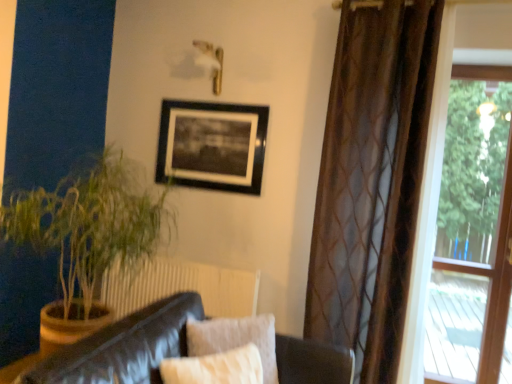
Question: Would you say leather couch at lower left is a long distance from transparent glass window at right?

Choices:
 (A) yes
 (B) no

Answer: (A)

Question: Is the depth of leather couch at lower left less than that of transparent glass window at right?

Choices:
 (A) yes
 (B) no

Answer: (A)

Question: Considering the relative sizes of leather couch at lower left and transparent glass window at right in the image provided, is leather couch at lower left wider than transparent glass window at right?

Choices:
 (A) yes
 (B) no

Answer: (A)

Question: Is leather couch at lower left thinner than transparent glass window at right?

Choices:
 (A) yes
 (B) no

Answer: (B)

Question: Does leather couch at lower left have a lesser height compared to transparent glass window at right?

Choices:
 (A) no
 (B) yes

Answer: (B)

Question: Considering the relative sizes of leather couch at lower left and transparent glass window at right in the image provided, is leather couch at lower left smaller than transparent glass window at right?

Choices:
 (A) yes
 (B) no

Answer: (B)

Question: Is transparent glass window at right positioned behind green leafy plant at left?

Choices:
 (A) yes
 (B) no

Answer: (A)

Question: Is transparent glass window at right bigger than green leafy plant at left?

Choices:
 (A) no
 (B) yes

Answer: (A)

Question: Is transparent glass window at right in contact with green leafy plant at left?

Choices:
 (A) yes
 (B) no

Answer: (B)

Question: From a real-world perspective, is transparent glass window at right beneath green leafy plant at left?

Choices:
 (A) yes
 (B) no

Answer: (B)

Question: Does transparent glass window at right turn towards green leafy plant at left?

Choices:
 (A) yes
 (B) no

Answer: (B)

Question: From the image's perspective, does transparent glass window at right appear lower than green leafy plant at left?

Choices:
 (A) yes
 (B) no

Answer: (B)

Question: Does leather couch at lower left have a larger size compared to brown sheer curtain at right?

Choices:
 (A) no
 (B) yes

Answer: (A)